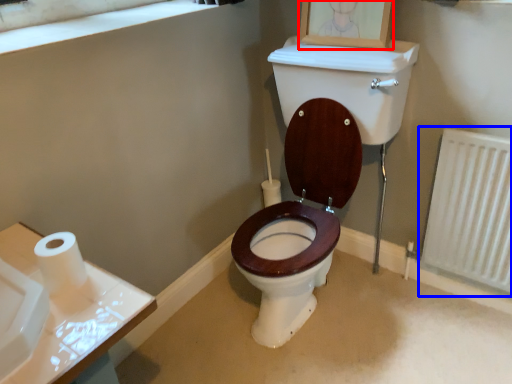
Question: Which object is closer to the camera taking this photo, picture frame (highlighted by a red box) or radiator (highlighted by a blue box)?

Choices:
 (A) picture frame
 (B) radiator

Answer: (B)